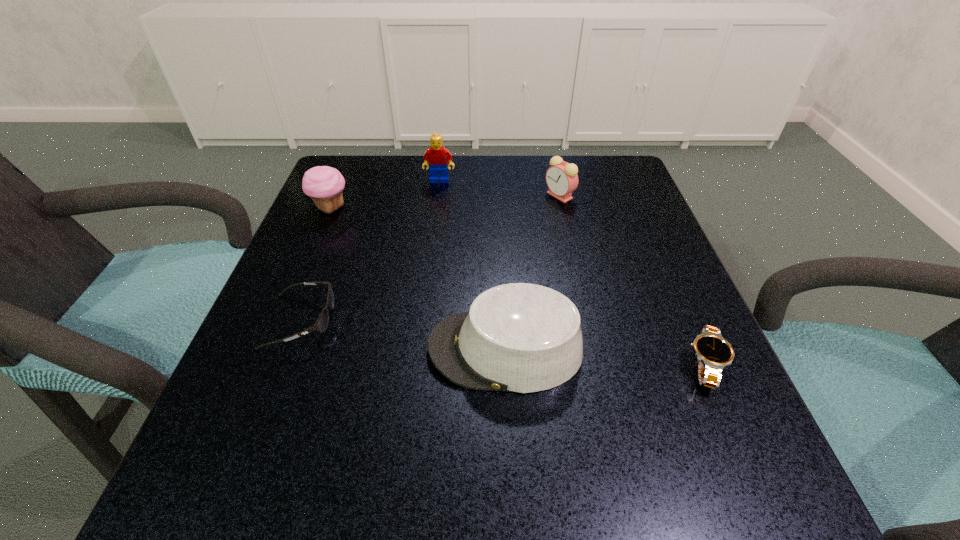
Identify the location of free location that satisfies the following two spatial constraints: 1. on the front-facing side of the sunglasses; 2. on the back side of the watch. (284, 364).

You are a GUI agent. You are given a task and a screenshot of the screen. Output one action in this format:
    pyautogui.click(x=<x>, y=<y>)
    Task: Click on the vacant space that satisfies the following two spatial constraints: 1. on the front-facing side of the hat; 2. on the back side of the watch
    
    Given the screenshot: What is the action you would take?
    pyautogui.click(x=506, y=364)

Where is `vacant space that satisfies the following two spatial constraints: 1. on the face of the alarm clock; 2. on the right side of the shortest object`? The width and height of the screenshot is (960, 540). vacant space that satisfies the following two spatial constraints: 1. on the face of the alarm clock; 2. on the right side of the shortest object is located at coordinates (598, 364).

Find the location of a particular element. The width and height of the screenshot is (960, 540). free space that satisfies the following two spatial constraints: 1. on the front-facing side of the watch; 2. on the right side of the tallest object is located at coordinates (417, 364).

Locate an element on the screen. Image resolution: width=960 pixels, height=540 pixels. blank area in the image that satisfies the following two spatial constraints: 1. on the back side of the watch; 2. on the front-facing side of the fifth tallest object is located at coordinates (685, 321).

Where is `free location that satisfies the following two spatial constraints: 1. on the front-facing side of the watch; 2. on the left side of the hat`? free location that satisfies the following two spatial constraints: 1. on the front-facing side of the watch; 2. on the left side of the hat is located at coordinates (506, 364).